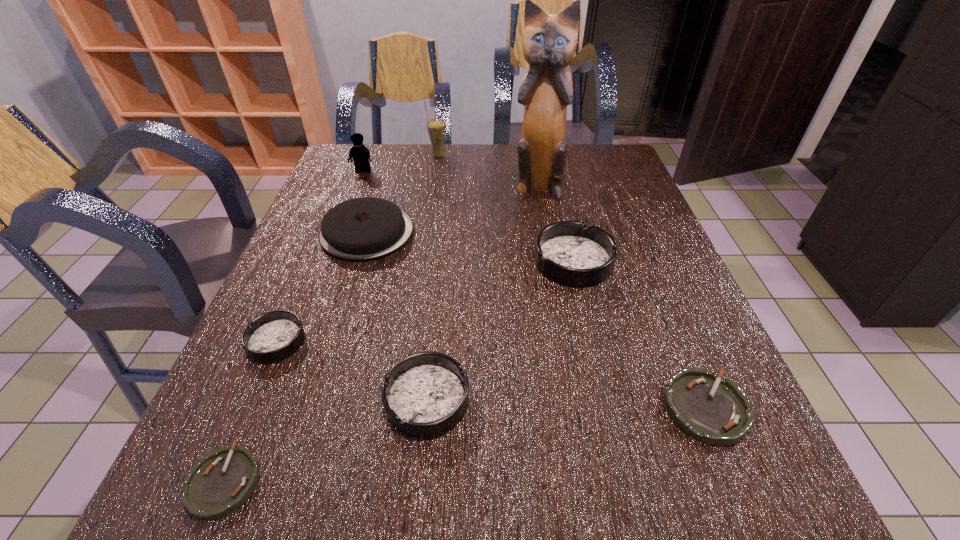
Identify the location of free space located on the left of the fifth tallest object. This screenshot has height=540, width=960. (392, 261).

Where is `vacant space located on the back of the second tallest ashtray`? This screenshot has height=540, width=960. vacant space located on the back of the second tallest ashtray is located at coordinates (438, 288).

I want to click on free location located 0.300m on the back of the fourth nearest object, so click(x=324, y=230).

The image size is (960, 540). Find the location of `vacant space located 0.220m on the back of the fourth tallest ashtray`. vacant space located 0.220m on the back of the fourth tallest ashtray is located at coordinates (656, 288).

Image resolution: width=960 pixels, height=540 pixels. I want to click on free space located 0.240m on the right of the left green ashtray, so click(x=420, y=480).

Locate an element on the screen. cat located at the far edge is located at coordinates [x=549, y=43].

The width and height of the screenshot is (960, 540). What are the coordinates of `straw for drinking that is at the far edge` in the screenshot? It's located at (436, 127).

Identify the location of Lego that is at the far edge. (361, 155).

Where is `object that is at the near edge`? The width and height of the screenshot is (960, 540). object that is at the near edge is located at coordinates (220, 482).

This screenshot has height=540, width=960. I want to click on Lego that is positioned at the left edge, so click(361, 155).